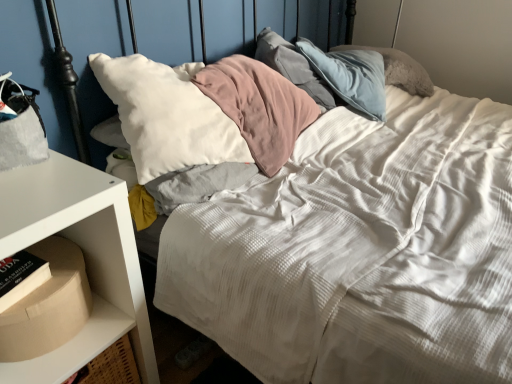
At what (x,y) coordinates should I click in order to perform the action: click on white matte nightstand at left. Please return your answer as a coordinate pair (x, y). Looking at the image, I should click on (85, 258).

The image size is (512, 384). What do you see at coordinates (85, 258) in the screenshot?
I see `white matte nightstand at left` at bounding box center [85, 258].

In order to face white matte nightstand at left, should I rotate leftwards or rightwards?

Turn left by 25.678 degrees to look at white matte nightstand at left.

What are the coordinates of `white matte nightstand at left` in the screenshot? It's located at (85, 258).